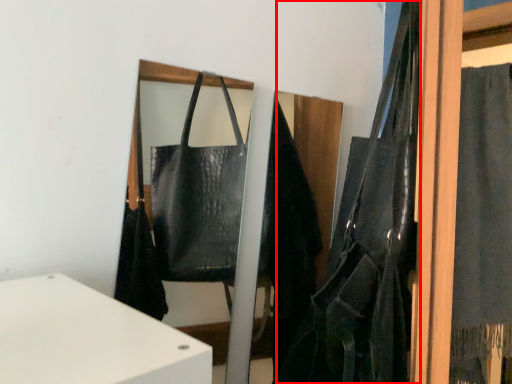
Question: Considering the relative positions of shoulder bag (annotated by the red box) and curtain in the image provided, where is shoulder bag (annotated by the red box) located with respect to the staircase?

Choices:
 (A) right
 (B) left

Answer: (B)